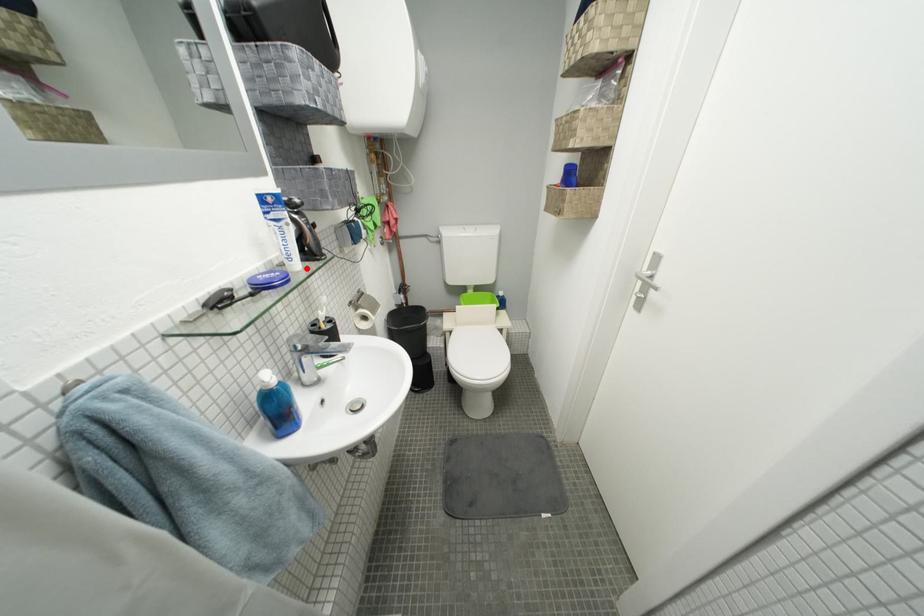
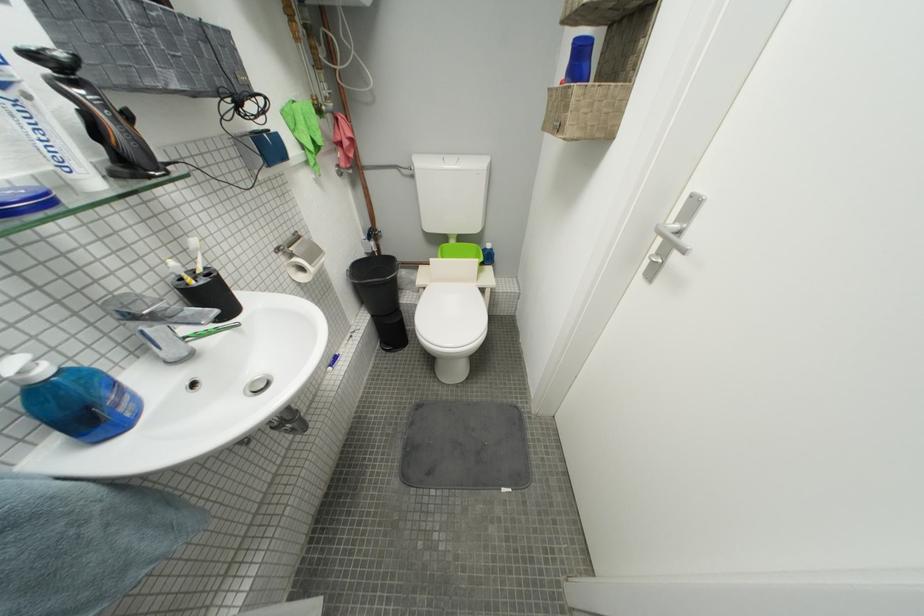
Question: I am providing you with two images of the same scene from different viewpoints. Image1 has a red point marked. In image2, the corresponding 3D location appears at what relative position? Reply with the corresponding letter.

Choices:
 (A) Closer
 (B) Farther

Answer: (B)